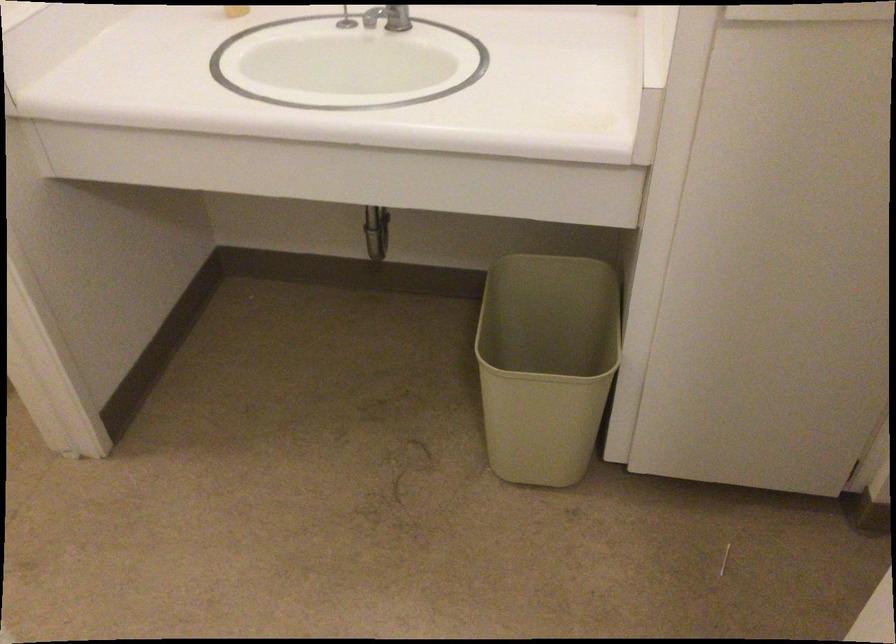
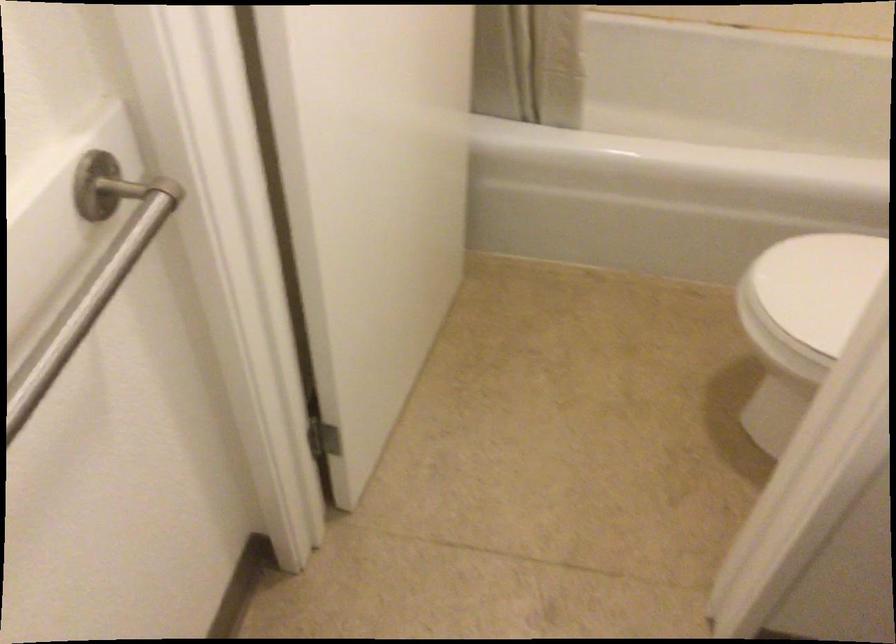
Based on the continuous images, in which direction is the camera rotating?

The camera's rotation is toward left-down.